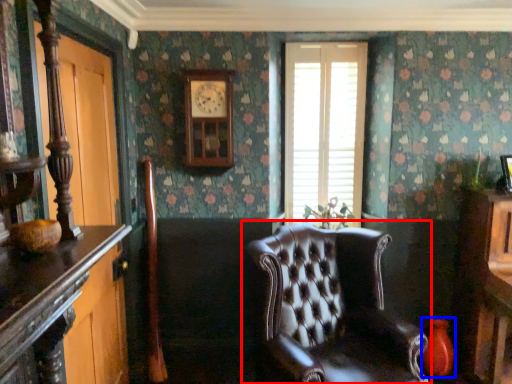
Question: Which point is further to the camera, chair (highlighted by a red box) or vase (highlighted by a blue box)?

Choices:
 (A) chair
 (B) vase

Answer: (B)